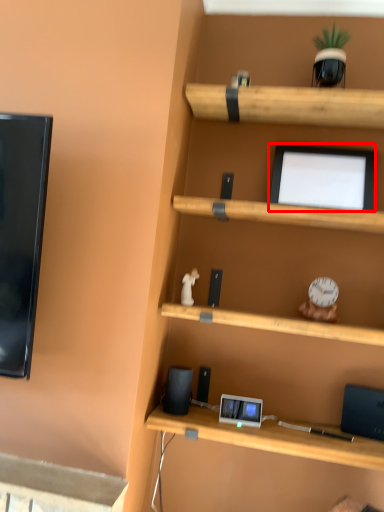
Question: Considering the relative positions of computer monitor (annotated by the red box) and speaker in the image provided, where is computer monitor (annotated by the red box) located with respect to the staircase?

Choices:
 (A) left
 (B) right

Answer: (B)